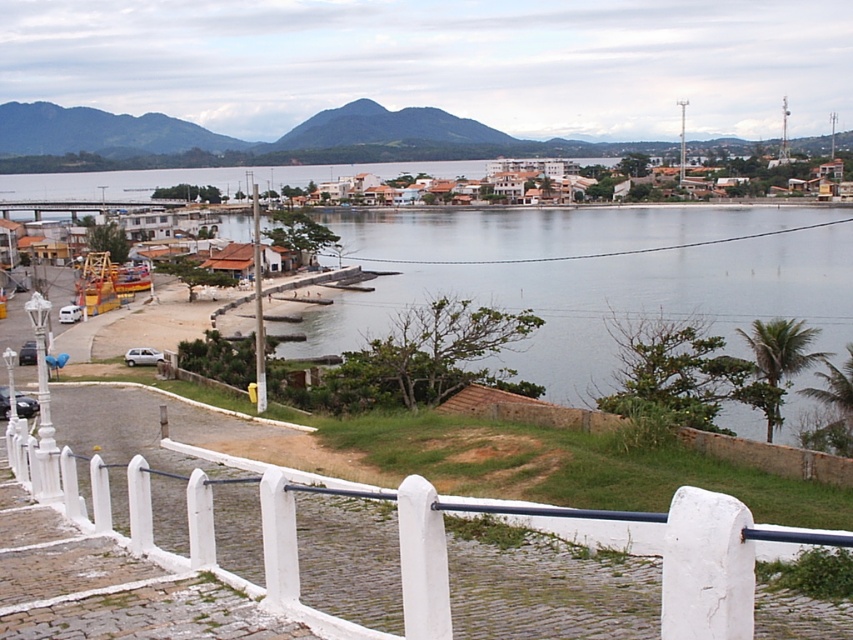
You are a tourist standing on the paved pathway and want to take a photo of the clear water at center and the white painted wood fence at lower center. Which object will appear larger in the photo?

The clear water at center will appear larger in the photo because it is much taller than the white painted wood fence at lower center.

In the scene shown: You are standing at the beginning of the coastal town pathway and see two points marked in the scene. Which point, point [231,224] or point [428,560], is closer to you?

Point [231,224] is closer to you because it is further to the viewer than point [428,560].

You are a tourist standing at the entrance of the coastal town and want to take a photo of both the white painted wood fence at lower center and the white textured buildings at center. Can you fit both in your camera frame if your camera can only capture objects within a 10m width? Please explain based on their sizes.

The white painted wood fence at lower center is smaller than the white textured buildings at center. Since the camera can capture up to 10m width, and the fence is smaller, it is likely possible to fit both within the frame as long as their combined width does not exceed 10 meters. However, exact positioning and distance from the camera would determine the final result.